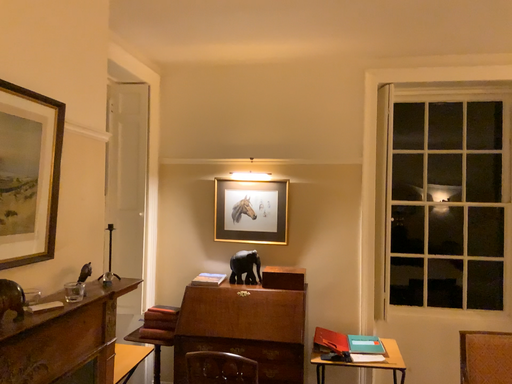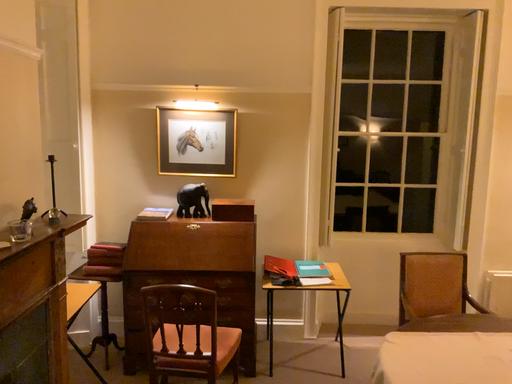
Question: How did the camera likely rotate when shooting the video?

Choices:
 (A) rotated left
 (B) rotated right

Answer: (B)